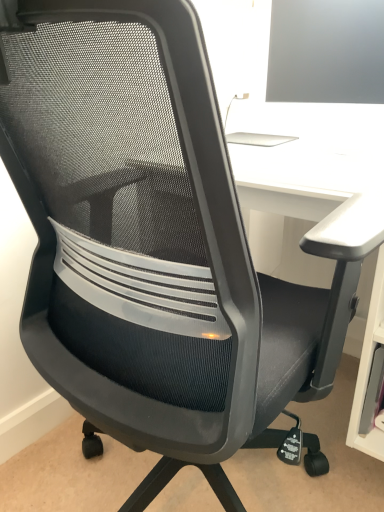
Where is `satin black monitor at upper right`? This screenshot has height=512, width=384. satin black monitor at upper right is located at coordinates (326, 51).

This screenshot has height=512, width=384. Describe the element at coordinates (326, 51) in the screenshot. I see `satin black monitor at upper right` at that location.

The width and height of the screenshot is (384, 512). Identify the location of satin black monitor at upper right. (326, 51).